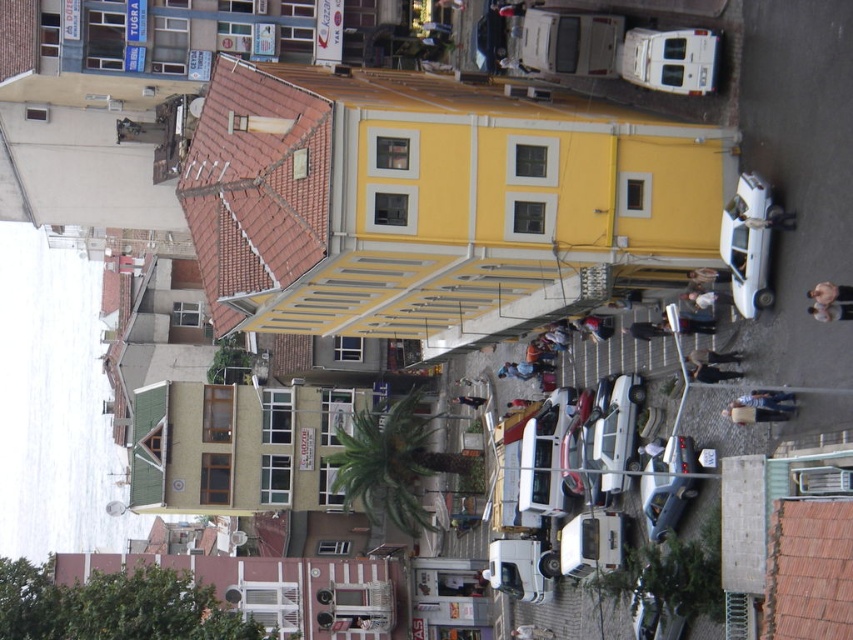
Which of these two, white glossy car at right or blue denim jeans at lower right, stands shorter?

With less height is blue denim jeans at lower right.

Which is in front, point (733, 250) or point (782, 392)?

Positioned in front is point (782, 392).

Does point (746, 248) come closer to viewer compared to point (775, 401)?

No, (746, 248) is behind (775, 401).

I want to click on white glossy car at right, so click(747, 243).

Find the location of a particular element. This screenshot has width=853, height=640. smooth beige doll at center is located at coordinates (830, 301).

Is smooth beige doll at center to the right of light brown leather jacket at center from the viewer's perspective?

Indeed, smooth beige doll at center is positioned on the right side of light brown leather jacket at center.

Is point (830, 301) closer to camera compared to point (698, 360)?

That is True.

At what (x,y) coordinates should I click in order to perform the action: click on smooth beige doll at center. Please return your answer as a coordinate pair (x, y). Looking at the image, I should click on (830, 301).

Does white matte van at center appear on the left side of metallic silver car at center?

Yes, white matte van at center is to the left of metallic silver car at center.

Image resolution: width=853 pixels, height=640 pixels. What are the coordinates of `white matte van at center` in the screenshot? It's located at (544, 456).

At what (x,y) coordinates should I click in order to perform the action: click on white matte van at center. Please return your answer as a coordinate pair (x, y). Looking at the image, I should click on (544, 456).